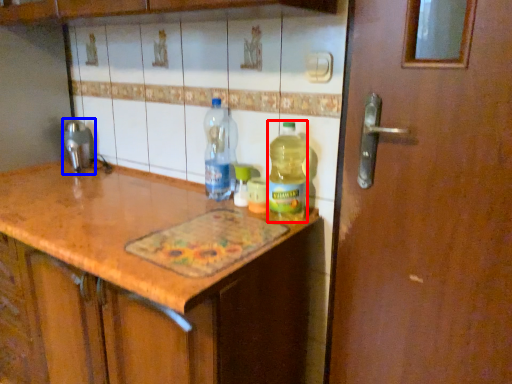
Question: Which object appears farthest to the camera in this image, bottle (highlighted by a red box) or faucet (highlighted by a blue box)?

Choices:
 (A) bottle
 (B) faucet

Answer: (B)